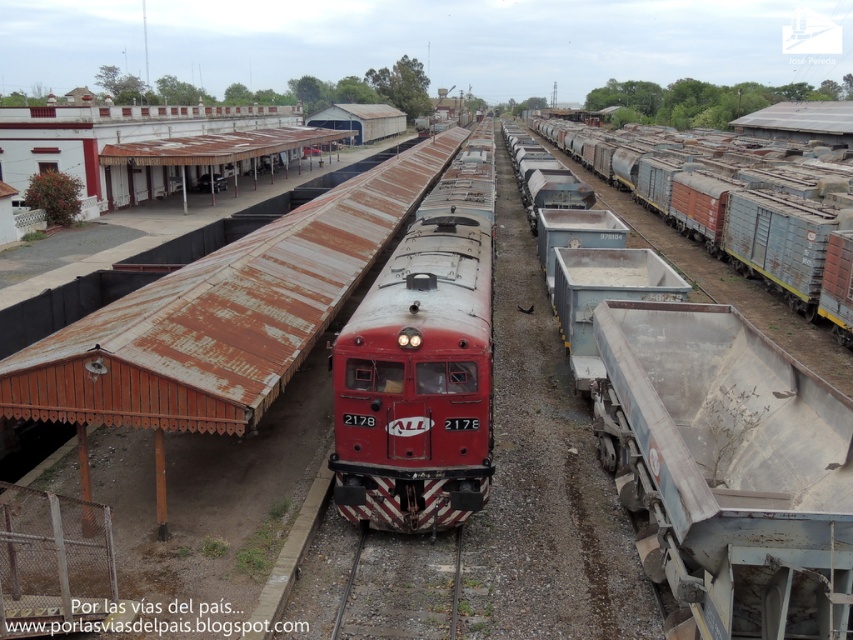
Question: Among these objects, which one is farthest from the camera?

Choices:
 (A) rusty metal freight car at center
 (B) red matte locomotive at center
 (C) gray gravel train track at center

Answer: (A)

Question: Is rusty metal freight car at center thinner than gray gravel train track at center?

Choices:
 (A) no
 (B) yes

Answer: (A)

Question: Which point appears farthest from the camera in this image?

Choices:
 (A) (480, 157)
 (B) (810, 257)

Answer: (A)

Question: Does rusty metal freight car at center have a greater width compared to gray gravel train track at center?

Choices:
 (A) yes
 (B) no

Answer: (A)

Question: Which object is positioned closest to the rusty metal freight car at center?

Choices:
 (A) red matte locomotive at center
 (B) gray gravel train track at center

Answer: (A)

Question: In this image, where is red matte locomotive at center located relative to rusty metal freight car at center?

Choices:
 (A) below
 (B) above

Answer: (A)